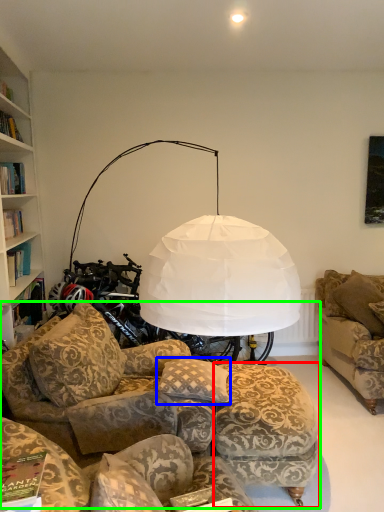
Question: Considering the real-world distances, which object is closest to stool (highlighted by a red box)? pillow (highlighted by a blue box) or studio couch (highlighted by a green box).

Choices:
 (A) pillow
 (B) studio couch

Answer: (B)